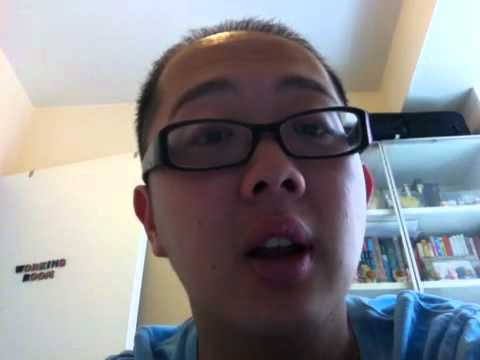
The image size is (480, 360). Find the location of `door label`. door label is located at coordinates (52, 264).